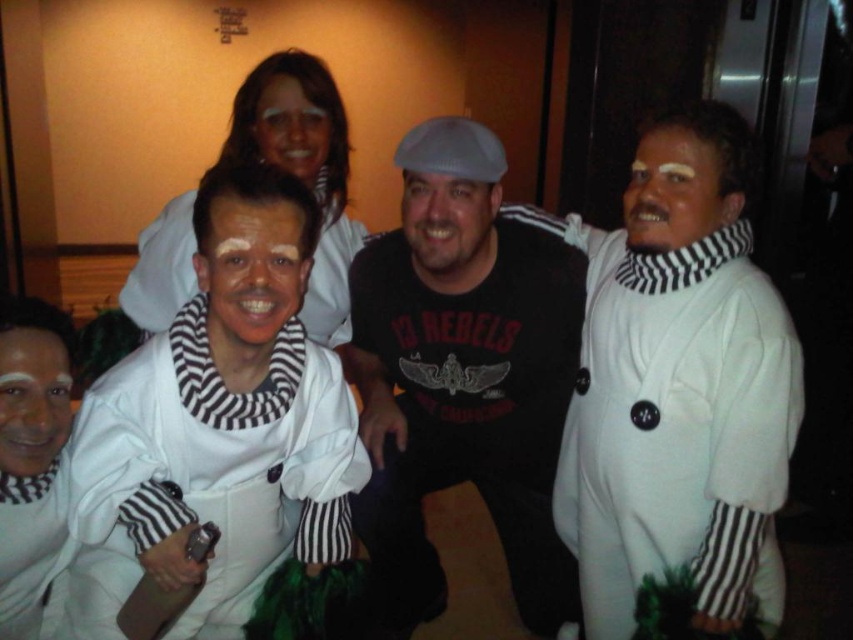
Question: Which of the following is the farthest from the observer?

Choices:
 (A) (194, 339)
 (B) (721, 449)
 (C) (492, 420)

Answer: (C)

Question: Can you confirm if white matte jumpsuit at center is bigger than black matte shirt at center?

Choices:
 (A) yes
 (B) no

Answer: (B)

Question: Can you confirm if black matte shirt at center is positioned above white matte robe at right?

Choices:
 (A) yes
 (B) no

Answer: (A)

Question: Among these points, which one is farthest from the camera?

Choices:
 (A) (582, 481)
 (B) (509, 284)

Answer: (A)

Question: Does white matte jumpsuit at center have a greater width compared to white matte robe at right?

Choices:
 (A) no
 (B) yes

Answer: (B)

Question: Which point is closer to the camera?

Choices:
 (A) (740, 234)
 (B) (364, 262)

Answer: (A)